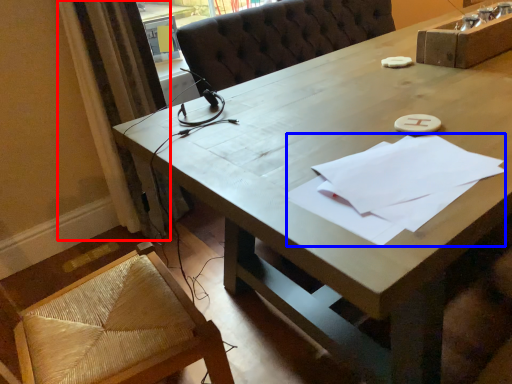
Question: Which object is further to the camera taking this photo, curtain (highlighted by a red box) or notepad (highlighted by a blue box)?

Choices:
 (A) curtain
 (B) notepad

Answer: (A)